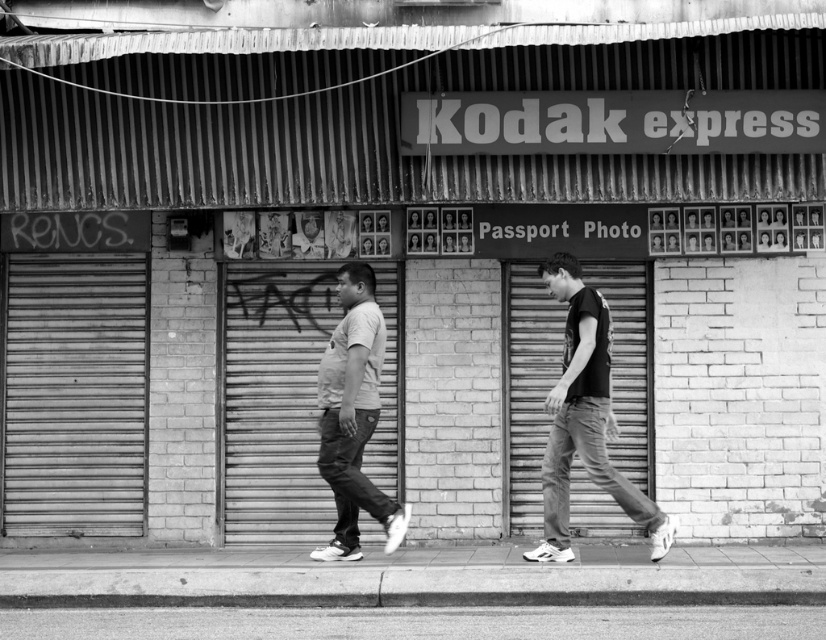
Question: Can you confirm if smooth concrete pavement at lower center is bigger than matte white t-shirt at center?

Choices:
 (A) no
 (B) yes

Answer: (A)

Question: Which point appears closest to the camera in this image?

Choices:
 (A) coord(554,614)
 (B) coord(554,589)
 (C) coord(648,509)
 (D) coord(319,371)

Answer: (A)

Question: Can you confirm if matte white t-shirt at center is bigger than smooth concrete curb at lower center?

Choices:
 (A) yes
 (B) no

Answer: (A)

Question: Which object is closer to the camera taking this photo?

Choices:
 (A) black cotton t-shirt at center
 (B) matte white t-shirt at center

Answer: (A)

Question: Which of the following is the farthest from the observer?

Choices:
 (A) black cotton t-shirt at center
 (B) smooth concrete curb at lower center

Answer: (A)

Question: Is smooth concrete pavement at lower center positioned before black cotton t-shirt at center?

Choices:
 (A) no
 (B) yes

Answer: (B)